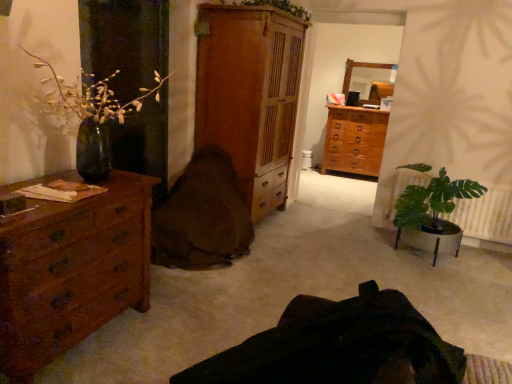
Where is `vacant space underneath green glossy vase at left, marked as the 1th houseplant in a left-to-right arrangement (from a real-world perspective)`? This screenshot has height=384, width=512. vacant space underneath green glossy vase at left, marked as the 1th houseplant in a left-to-right arrangement (from a real-world perspective) is located at coordinates (86, 183).